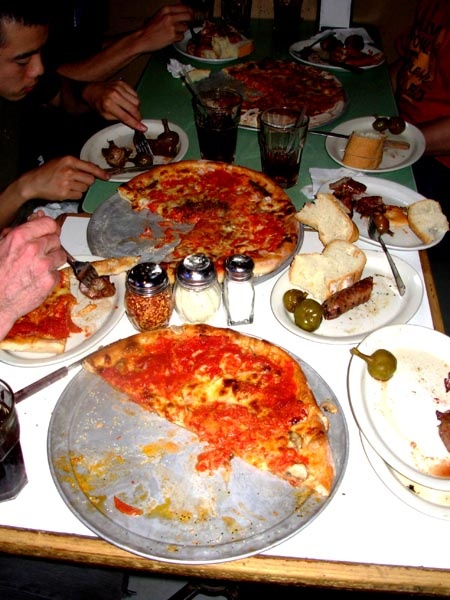
At what (x,y) coordinates should I click in order to perform the action: click on round plate. Please return your answer as a coordinate pair (x, y). Looking at the image, I should click on (401, 303).